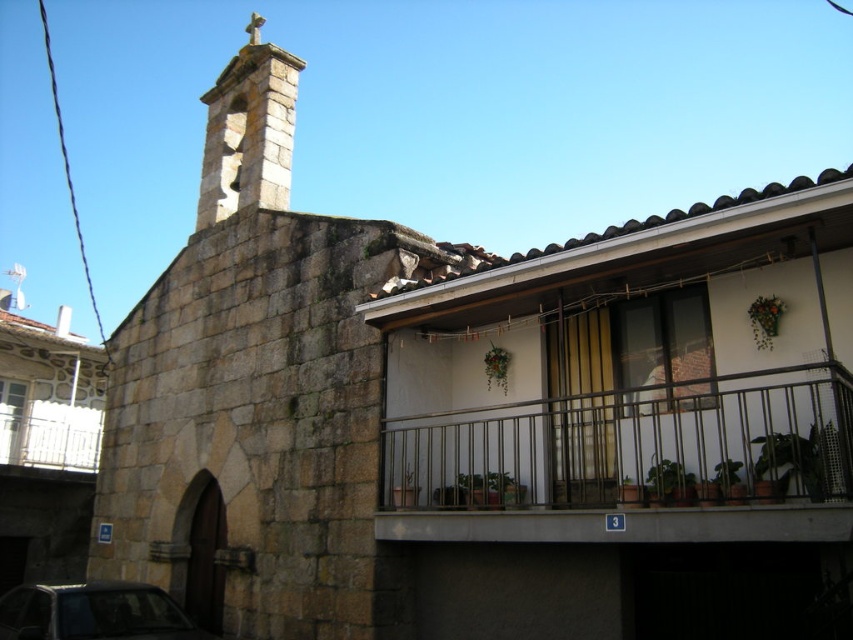
Question: Which of the following is the farthest from the observer?

Choices:
 (A) shiny black car at lower left
 (B) white metal balcony at upper left
 (C) metallic railing at center

Answer: (B)

Question: Which object appears closest to the camera in this image?

Choices:
 (A) metallic railing at center
 (B) shiny black car at lower left
 (C) white metal balcony at upper left

Answer: (A)

Question: Is metallic railing at center wider than shiny black car at lower left?

Choices:
 (A) no
 (B) yes

Answer: (B)

Question: Which is farther from the shiny black car at lower left?

Choices:
 (A) white metal balcony at upper left
 (B) metallic railing at center

Answer: (A)

Question: Can you confirm if metallic railing at center is positioned to the right of shiny black car at lower left?

Choices:
 (A) yes
 (B) no

Answer: (A)

Question: Can you confirm if metallic railing at center is positioned to the right of white metal balcony at upper left?

Choices:
 (A) no
 (B) yes

Answer: (B)